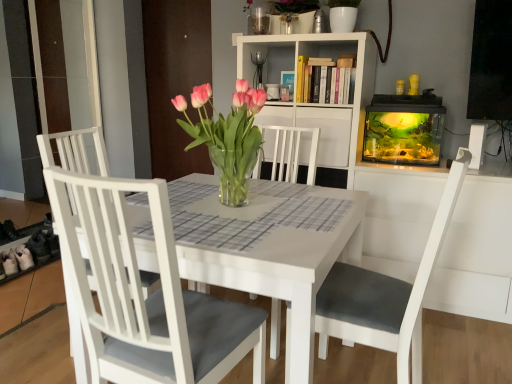
What is the approximate width of pink glass vase at center?

The width of pink glass vase at center is 16.96 inches.

Image resolution: width=512 pixels, height=384 pixels. What do you see at coordinates (329, 132) in the screenshot?
I see `white wood shelf at upper center` at bounding box center [329, 132].

The height and width of the screenshot is (384, 512). What do you see at coordinates (142, 293) in the screenshot?
I see `white matte chair at center, which appears as the 1th chair when viewed from the right` at bounding box center [142, 293].

The width and height of the screenshot is (512, 384). What are the coordinates of `pink glass vase at center` in the screenshot? It's located at (227, 137).

From the image's perspective, is pink glass vase at center beneath white wood shelf at upper center?

Yes, from the image's perspective, pink glass vase at center is beneath white wood shelf at upper center.

Which of these two, pink glass vase at center or white wood shelf at upper center, is smaller?

With smaller size is white wood shelf at upper center.

From a real-world perspective, does pink glass vase at center sit lower than white wood shelf at upper center?

No, from a real-world perspective, pink glass vase at center is not under white wood shelf at upper center.

In order to click on houseplant located on the left of white wood shelf at upper center in this screenshot , I will do `click(227, 137)`.

Which object is positioned more to the left, pink glass vase at center or transparent glass aquarium at right?

pink glass vase at center.

Is pink glass vase at center behind transparent glass aquarium at right?

No, the depth of pink glass vase at center is less than that of transparent glass aquarium at right.

Does pink glass vase at center contain transparent glass aquarium at right?

No, transparent glass aquarium at right is not surrounded by pink glass vase at center.

Does transparent glass aquarium at right touch white wood bookshelf at upper center?

They are not placed beside each other.

Considering the sizes of transparent glass aquarium at right and white wood bookshelf at upper center in the image, is transparent glass aquarium at right wider or thinner than white wood bookshelf at upper center?

Considering their sizes, transparent glass aquarium at right looks slimmer than white wood bookshelf at upper center.

Considering the relative sizes of transparent glass aquarium at right and white wood bookshelf at upper center in the image provided, is transparent glass aquarium at right smaller than white wood bookshelf at upper center?

Yes, transparent glass aquarium at right is smaller than white wood bookshelf at upper center.

Where is `bookcase that appears behind the transparent glass aquarium at right`? The image size is (512, 384). bookcase that appears behind the transparent glass aquarium at right is located at coordinates pos(317,103).

How many degrees apart are the facing directions of white wood bookshelf at upper center and white wood shelf at upper center?

3.42 degrees.

Based on the photo, between white wood bookshelf at upper center and white wood shelf at upper center, which one appears on the right side from the viewer's perspective?

Positioned to the right is white wood shelf at upper center.

Which point is more distant from viewer, (335, 109) or (321, 119)?

The point (335, 109) is behind.

In the image, there is a white wood bookshelf at upper center. Where is `shelf below it (from the image's perspective)`? Image resolution: width=512 pixels, height=384 pixels. shelf below it (from the image's perspective) is located at coordinates (329, 132).

Would you consider transparent glass aquarium at right to be distant from white matte chair at left, placed as the 1th chair when sorted from left to right?

Absolutely, transparent glass aquarium at right is distant from white matte chair at left, placed as the 1th chair when sorted from left to right.

Is transparent glass aquarium at right thinner than white matte chair at left, which is the second chair from right to left?

Indeed, transparent glass aquarium at right has a lesser width compared to white matte chair at left, which is the second chair from right to left.

From a real-world perspective, is transparent glass aquarium at right on top of white matte chair at left, placed as the 1th chair when sorted from left to right?

Correct, in the physical world, transparent glass aquarium at right is higher than white matte chair at left, placed as the 1th chair when sorted from left to right.

Could you tell me if transparent glass aquarium at right is facing white matte chair at left, placed as the 1th chair when sorted from left to right?

No, transparent glass aquarium at right does not turn towards white matte chair at left, placed as the 1th chair when sorted from left to right.

Looking at their sizes, would you say pink glass vase at center is wider or thinner than white matte chair at center, the 2th chair from the left?

Clearly, pink glass vase at center has less width compared to white matte chair at center, the 2th chair from the left.

How far apart are pink glass vase at center and white matte chair at center, the 2th chair from the left?

pink glass vase at center is 59.17 centimeters away from white matte chair at center, the 2th chair from the left.

From the image's perspective, is pink glass vase at center positioned above or below white matte chair at center, which appears as the 1th chair when viewed from the right?

From the image's perspective, pink glass vase at center appears above white matte chair at center, which appears as the 1th chair when viewed from the right.

Are pink glass vase at center and white matte chair at center, which appears as the 1th chair when viewed from the right, far apart?

No.

Is white wood shelf at upper center facing away from white wood bookshelf at upper center?

Absolutely, white wood shelf at upper center is directed away from white wood bookshelf at upper center.

From a real-world perspective, is white wood shelf at upper center positioned over white wood bookshelf at upper center based on gravity?

No, from a real-world perspective, white wood shelf at upper center is not over white wood bookshelf at upper center

From the image's perspective, between white wood shelf at upper center and white wood bookshelf at upper center, which one is located above?

white wood bookshelf at upper center, from the image's perspective.

At what (x,y) coordinates should I click in order to perform the action: click on shelf on the right of pink glass vase at center. Please return your answer as a coordinate pair (x, y). Looking at the image, I should click on (329, 132).

Locate an element on the screen. This screenshot has height=384, width=512. houseplant in front of the transparent glass aquarium at right is located at coordinates (227, 137).

When comparing their distances from white matte chair at left, which is the second chair from right to left, does white wood shelf at upper center or transparent glass aquarium at right seem further?

transparent glass aquarium at right is positioned further to the anchor white matte chair at left, which is the second chair from right to left.

Looking at the image, which one is located closer to white wood shelf at upper center, transparent glass aquarium at right or white wood bookshelf at upper center?

Based on the image, white wood bookshelf at upper center appears to be nearer to white wood shelf at upper center.

When comparing their distances from white matte chair at left, placed as the 1th chair when sorted from left to right, does white matte chair at center, which appears as the 1th chair when viewed from the right, or transparent glass aquarium at right seem further?

Based on the image, transparent glass aquarium at right appears to be further to white matte chair at left, placed as the 1th chair when sorted from left to right.

Based on their spatial positions, is pink glass vase at center or white wood bookshelf at upper center further from white matte chair at left, which is the second chair from right to left?

white wood bookshelf at upper center is positioned further to the anchor white matte chair at left, which is the second chair from right to left.

Considering their positions, is white matte chair at center, which appears as the 1th chair when viewed from the right, positioned closer to pink glass vase at center than transparent glass aquarium at right?

The object closer to pink glass vase at center is white matte chair at center, which appears as the 1th chair when viewed from the right.

In the scene shown: From the image, which object appears to be nearer to white matte chair at center, which appears as the 1th chair when viewed from the right, white wood shelf at upper center or pink glass vase at center?

pink glass vase at center.

Estimate the real-world distances between objects in this image. Which object is closer to white wood bookshelf at upper center, transparent glass aquarium at right or pink glass vase at center?

transparent glass aquarium at right is closer to white wood bookshelf at upper center.

Estimate the real-world distances between objects in this image. Which object is closer to white matte chair at center, the 2th chair from the left, white wood bookshelf at upper center or pink glass vase at center?

Based on the image, pink glass vase at center appears to be nearer to white matte chair at center, the 2th chair from the left.

I want to click on chair positioned between pink glass vase at center and white wood bookshelf at upper center from near to far, so click(x=73, y=150).

You are a GUI agent. You are given a task and a screenshot of the screen. Output one action in this format:
    pyautogui.click(x=<x>, y=<y>)
    Task: Click on the fireplace located between pink glass vase at center and white wood shelf at upper center in the depth direction
    The width and height of the screenshot is (512, 384).
    Given the screenshot: What is the action you would take?
    pyautogui.click(x=404, y=129)

Find the location of a particular element. The width and height of the screenshot is (512, 384). chair between pink glass vase at center and white matte chair at center, the 2th chair from the left, in the vertical direction is located at coordinates (73, 150).

You are a GUI agent. You are given a task and a screenshot of the screen. Output one action in this format:
    pyautogui.click(x=<x>, y=<y>)
    Task: Click on the chair located between white matte chair at left, which is the second chair from right to left, and transparent glass aquarium at right in the left-right direction
    
    Given the screenshot: What is the action you would take?
    pyautogui.click(x=142, y=293)